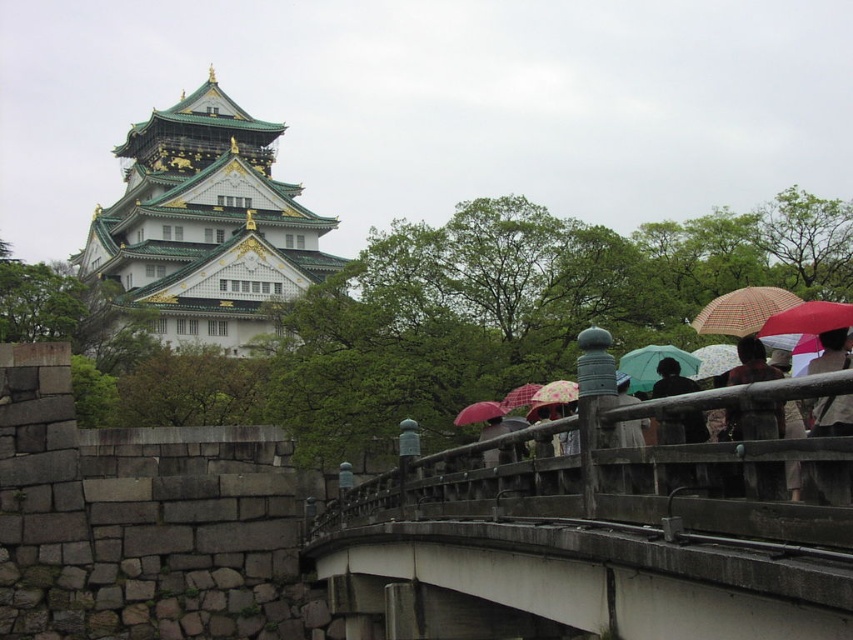
Question: Is matte black umbrella at upper right to the left of matte red umbrella at center from the viewer's perspective?

Choices:
 (A) no
 (B) yes

Answer: (A)

Question: Which of these objects is positioned farthest from the matte black umbrella at upper right?

Choices:
 (A) floral fabric umbrella at upper right
 (B) floral-patterned fabric umbrella at center

Answer: (B)

Question: Which object appears closest to the camera in this image?

Choices:
 (A) floral-patterned fabric umbrella at center
 (B) matte black umbrella at center
 (C) green metallic tower at upper left

Answer: (B)

Question: Does dark matte jacket at center come behind matte black umbrella at center?

Choices:
 (A) no
 (B) yes

Answer: (A)

Question: Is plaid fabric umbrella at upper right wider than dark matte jacket at center?

Choices:
 (A) no
 (B) yes

Answer: (B)

Question: Which point appears farthest from the camera in this image?

Choices:
 (A) (701, 428)
 (B) (724, 348)

Answer: (B)